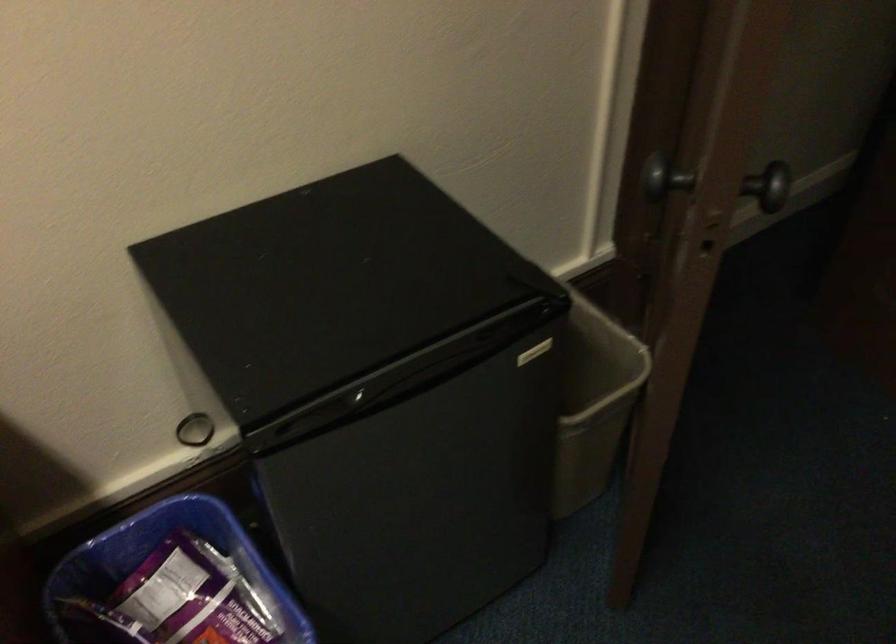
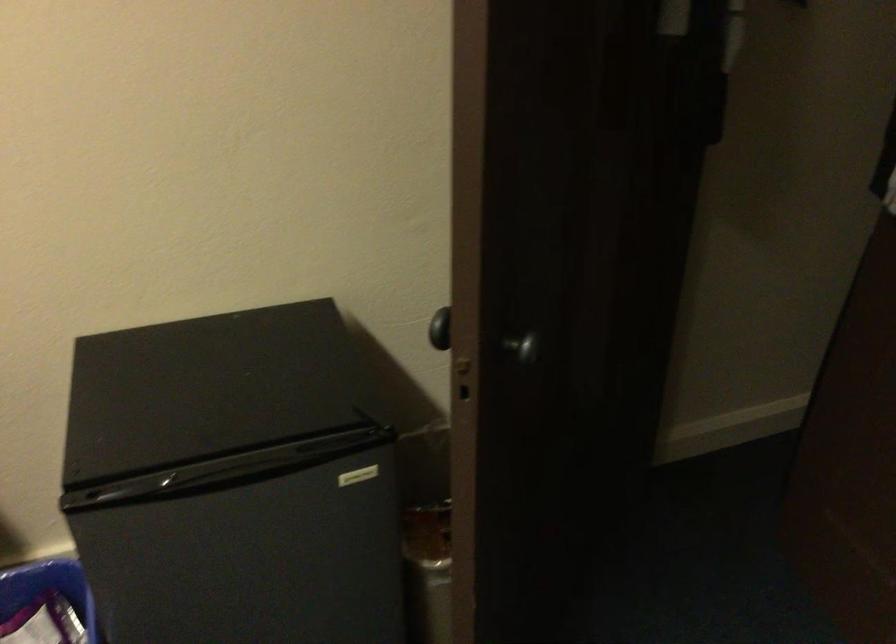
Question: What movement of the cameraman would produce the second image?

Choices:
 (A) Left
 (B) Right
 (C) Forward
 (D) Backward

Answer: (B)